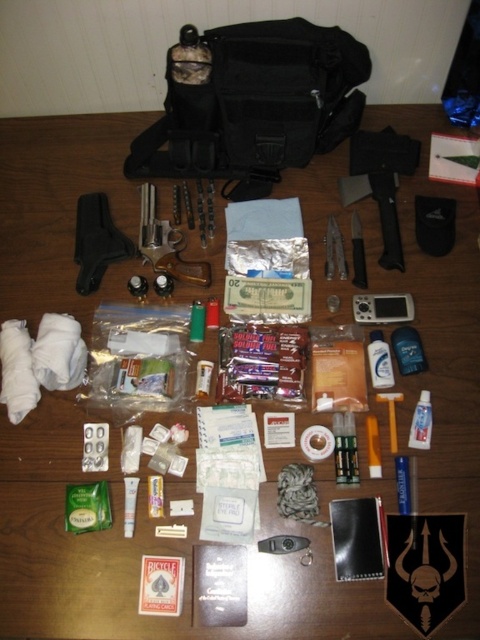
Question: Considering the real-world distances, which object is farthest from the matte black hatchet at center?

Choices:
 (A) black fabric bag at upper center
 (B) white plastic razor at center

Answer: (B)

Question: Can you confirm if black fabric bag at upper center is positioned above black plastic knife at center?

Choices:
 (A) yes
 (B) no

Answer: (A)

Question: Is matte black hatchet at center below clear plastic razor at center?

Choices:
 (A) yes
 (B) no

Answer: (B)

Question: Which object is the closest to the matte black hatchet at center?

Choices:
 (A) black plastic knife at center
 (B) black plastic gun at upper left
 (C) white plastic razor at center
 (D) black fabric bag at upper center

Answer: (A)

Question: Can you confirm if matte black hatchet at center is wider than wooden gun at center?

Choices:
 (A) no
 (B) yes

Answer: (B)

Question: Based on their relative distances, which object is farther from the black plastic knife at center?

Choices:
 (A) white plastic razor at center
 (B) clear plastic razor at center
 (C) black plastic gun at upper left

Answer: (C)